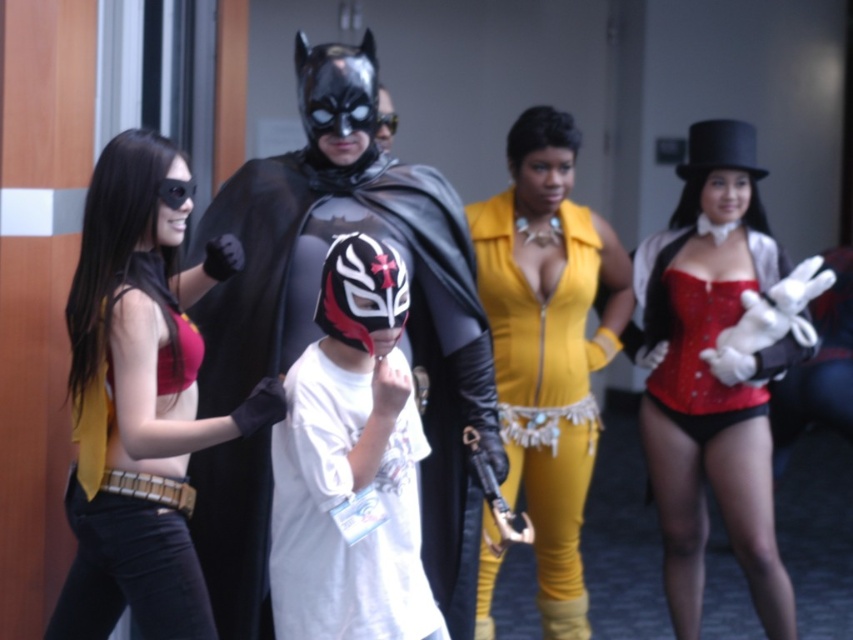
Question: Which of these objects is positioned farthest from the matte red top at left?

Choices:
 (A) shiny black costume at center
 (B) yellow leather jumpsuit at center
 (C) red satin corset at right

Answer: (C)

Question: Is white matte mask at center smaller than yellow leather jumpsuit at center?

Choices:
 (A) no
 (B) yes

Answer: (B)

Question: Which point is farther to the camera?

Choices:
 (A) white matte mask at center
 (B) yellow leather jumpsuit at center
 (C) matte red top at left

Answer: (B)

Question: Which point is farther from the camera taking this photo?

Choices:
 (A) (329, 300)
 (B) (489, 596)
 (C) (161, 288)
 (D) (259, 300)

Answer: (B)

Question: Is shiny black costume at center above white matte mask at center?

Choices:
 (A) no
 (B) yes

Answer: (B)

Question: Considering the relative positions of shiny black costume at center and matte red top at left in the image provided, where is shiny black costume at center located with respect to matte red top at left?

Choices:
 (A) above
 (B) below

Answer: (A)